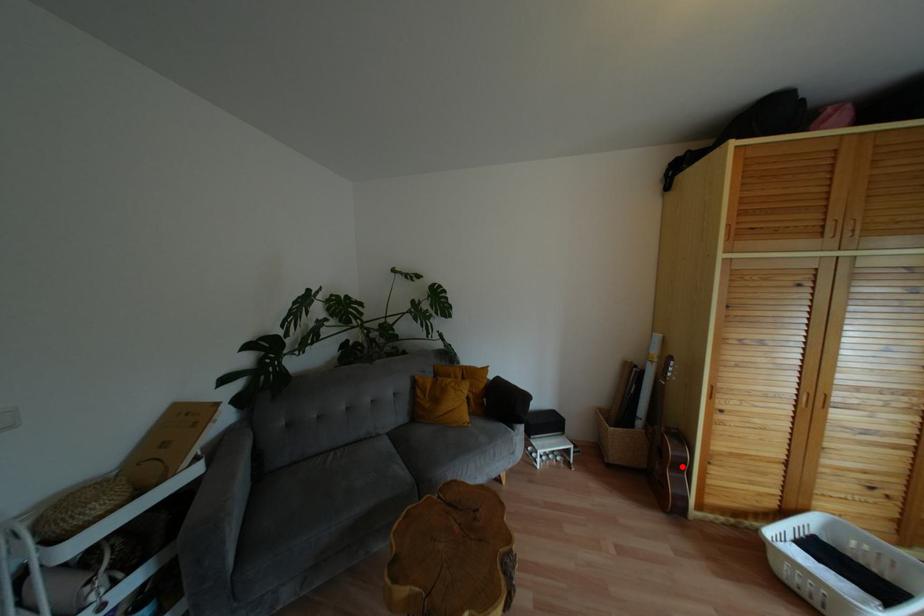
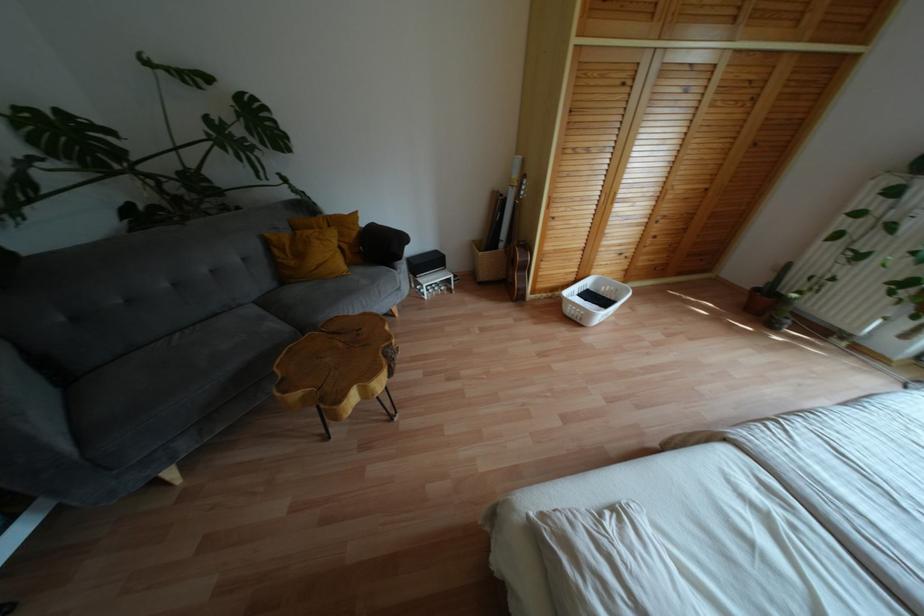
Find the pixel in the second image that matches the highlighted location in the first image.

(525, 267)